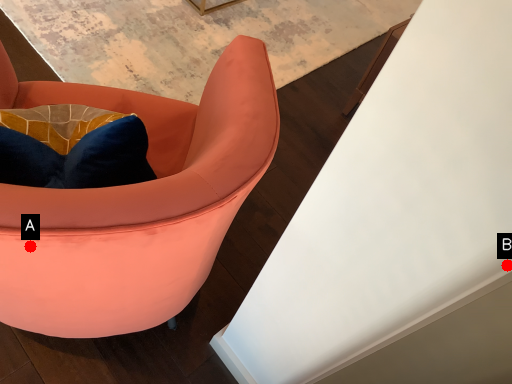
Question: Two points are circled on the image, labeled by A and B beside each circle. Which point is farther from the camera taking this photo?

Choices:
 (A) A is further
 (B) B is further

Answer: (A)